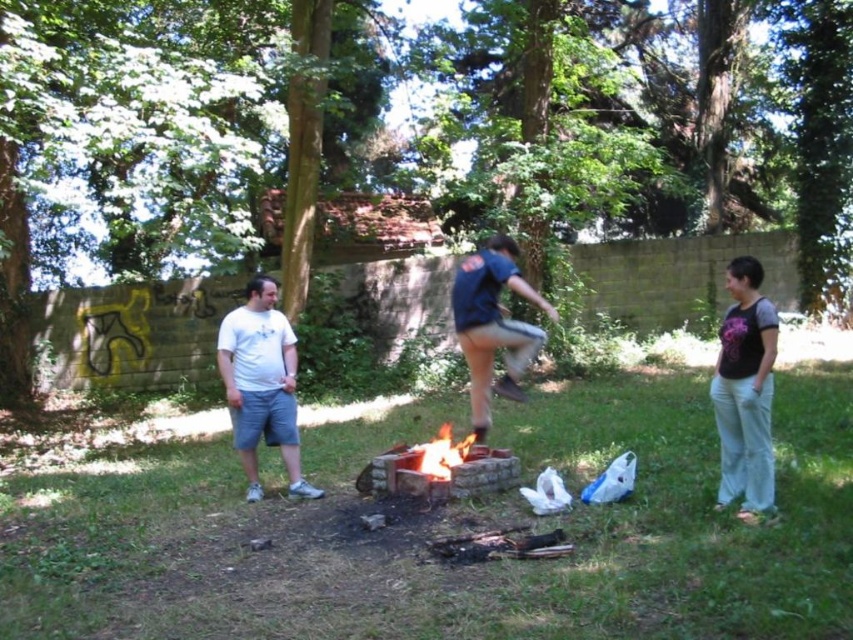
You are standing at the center of the scene and want to pick up both the matte black shirt at lower right and the white matte shorts at left. Which one should you move towards first if you want to pick up the one closer to you?

The white matte shorts at left is closer to you since it is positioned to the left of the matte black shirt at lower right, which is further to the right.